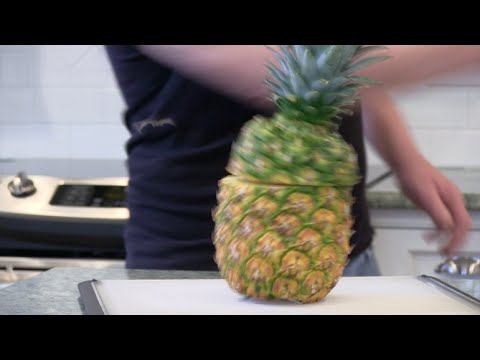
Image resolution: width=480 pixels, height=360 pixels. Identify the location of marble stove. (48, 286).